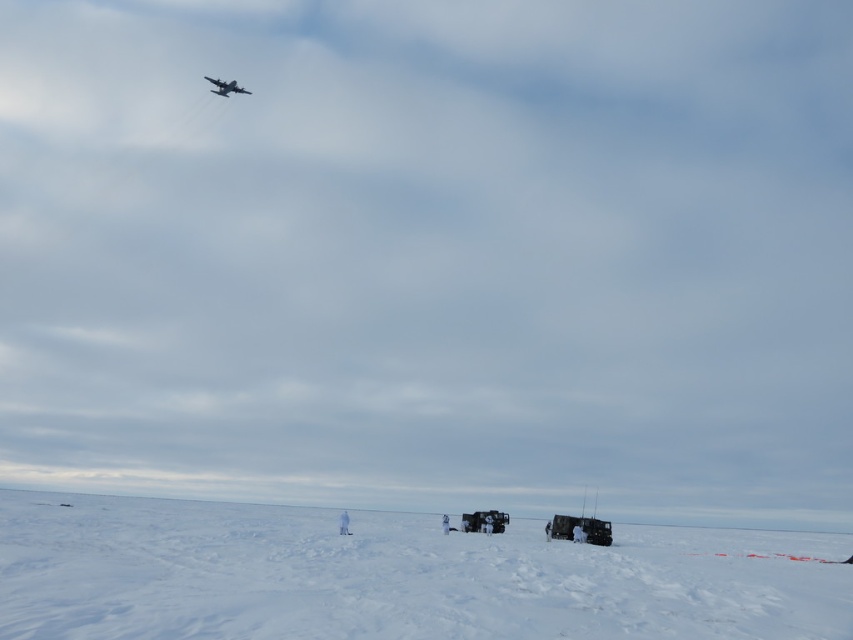
Question: Does metallic silver aircraft at upper left have a smaller size compared to white matte skier at lower center?

Choices:
 (A) no
 (B) yes

Answer: (A)

Question: Observing the image, what is the correct spatial positioning of white powdery snow at lower center in reference to white matte skier at lower center?

Choices:
 (A) right
 (B) left

Answer: (A)

Question: Which object is the closest to the white matte skier at lower center?

Choices:
 (A) metallic silver aircraft at upper left
 (B) white powdery snow at lower center

Answer: (B)

Question: Based on their relative distances, which object is farther from the metallic silver aircraft at upper left?

Choices:
 (A) white powdery snow at lower center
 (B) white matte skier at lower center

Answer: (B)

Question: Is metallic silver aircraft at upper left in front of white matte skier at lower center?

Choices:
 (A) yes
 (B) no

Answer: (B)

Question: Which point appears closest to the camera in this image?

Choices:
 (A) [x=343, y=529]
 (B) [x=718, y=616]

Answer: (B)